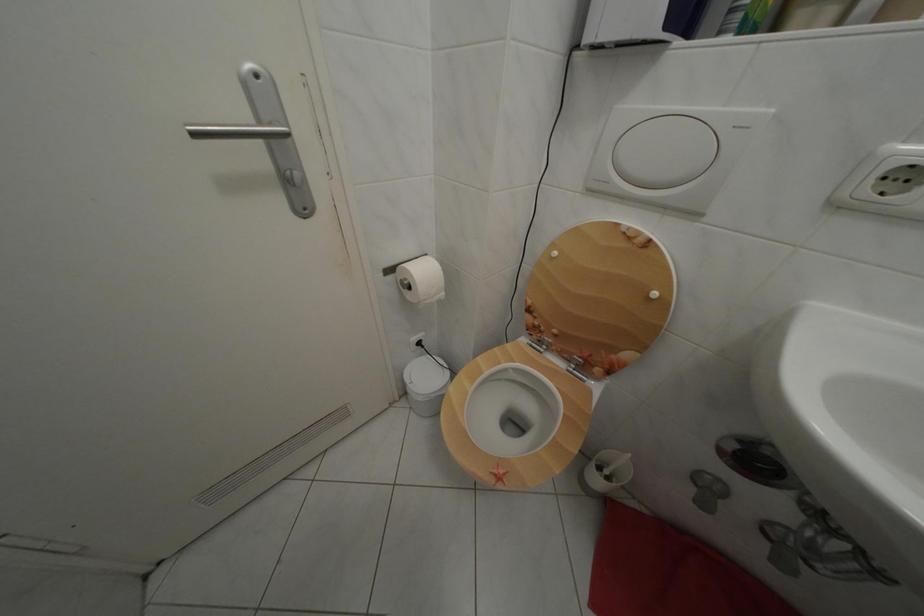
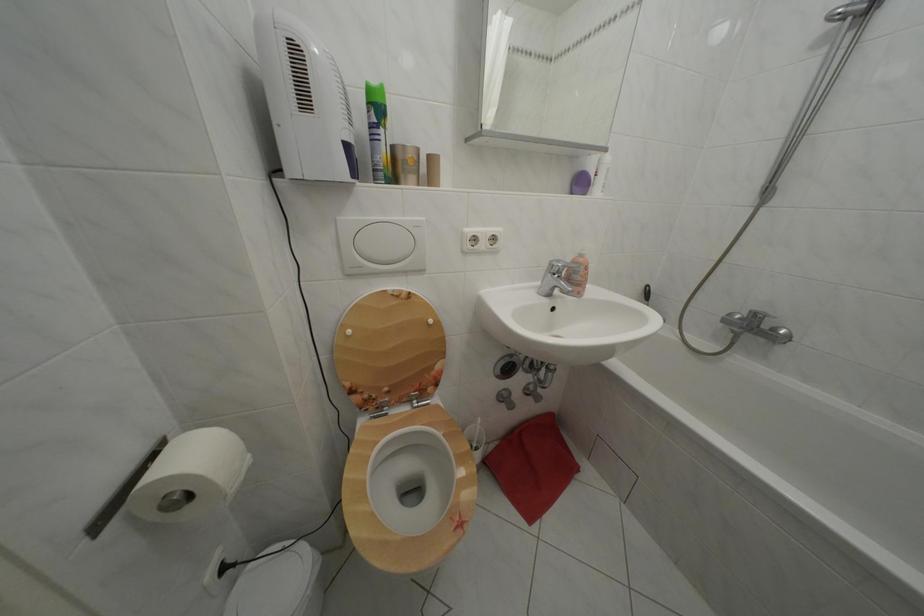
Locate, in the second image, the point that corresponds to the point at 564,259 in the first image.

(358, 338)